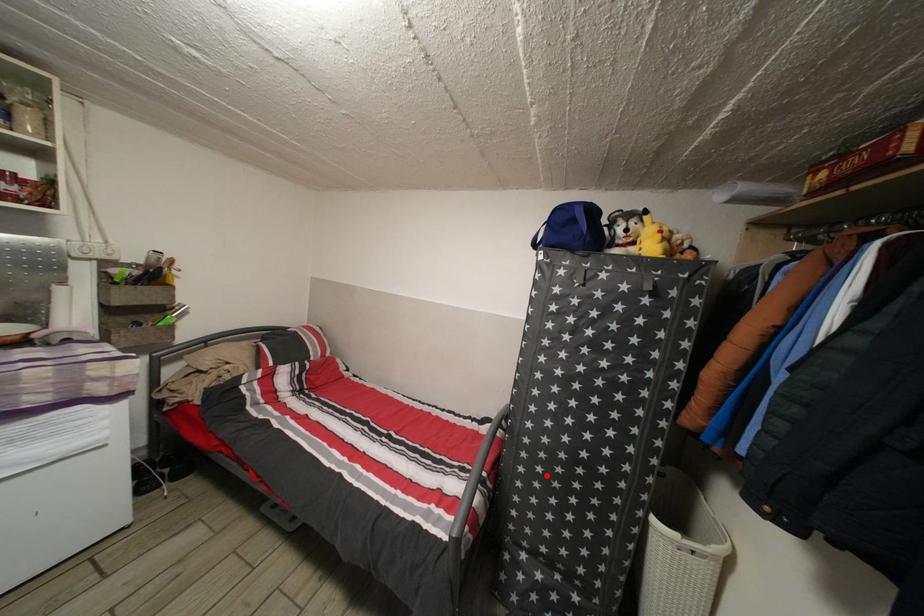
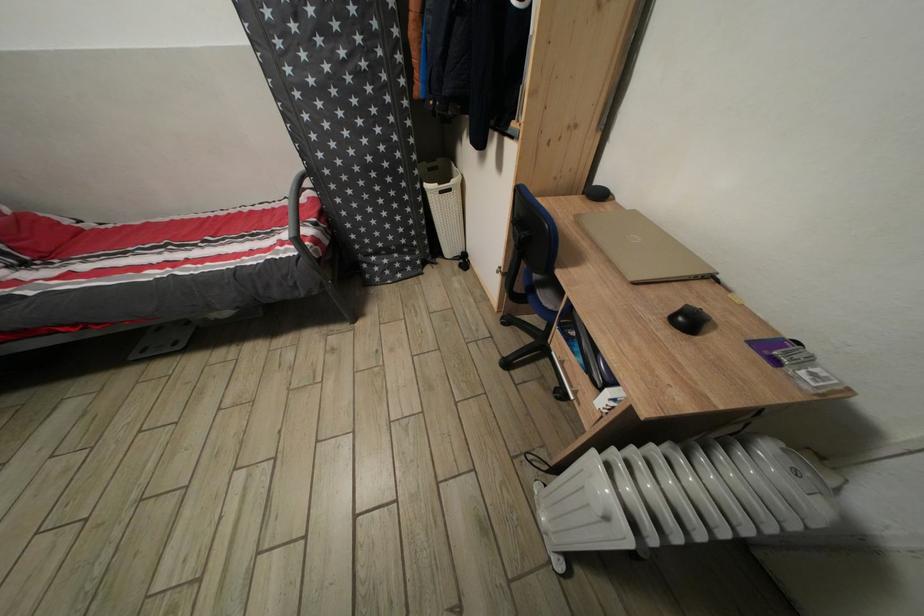
The point at the highlighted location is marked in the first image. Where is the corresponding point in the second image?

(357, 198)